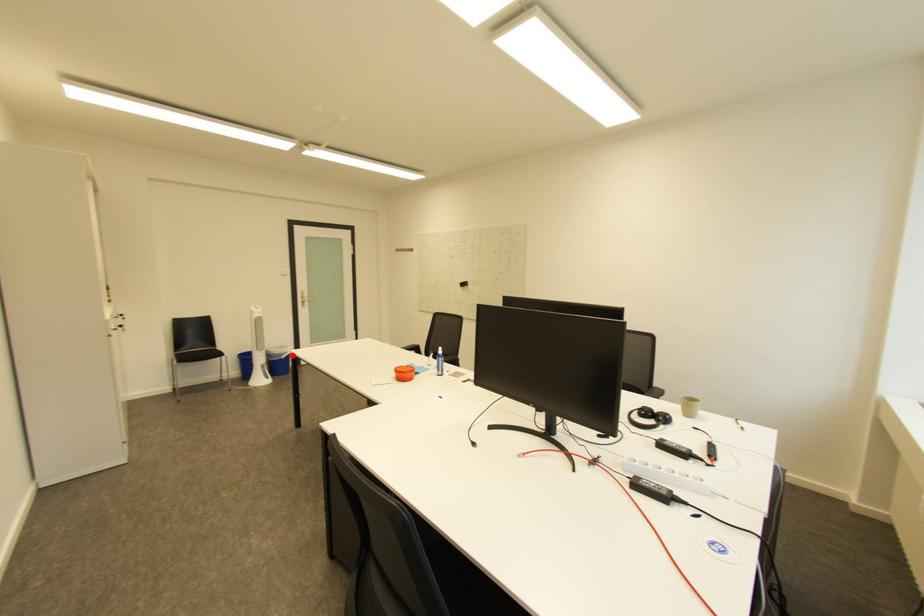
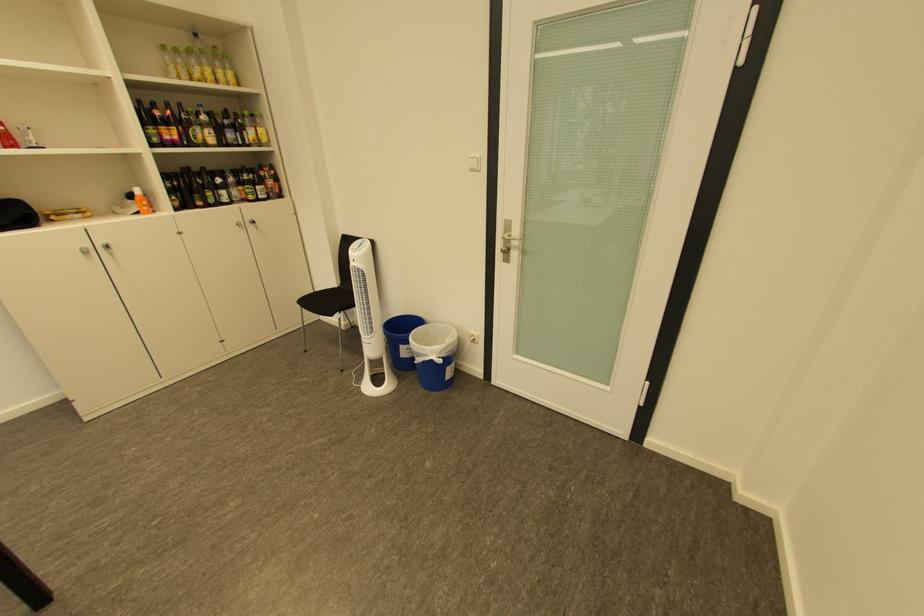
Question: I am providing you with two images of the same scene from different viewpoints. A red point is shown in image1. For the corresponding object point in image2, is it positioned nearer or farther from the camera?

Choices:
 (A) Nearer
 (B) Farther

Answer: (B)